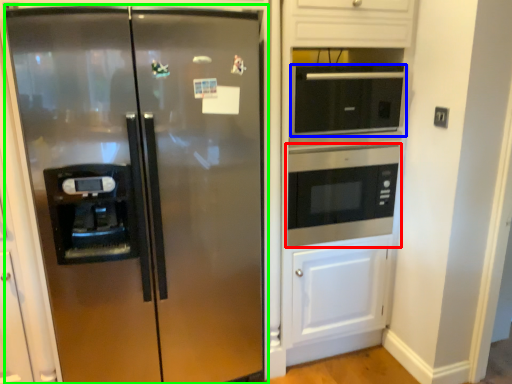
Question: Which object is positioned closest to microwave oven (highlighted by a red box)? Select from microwave oven (highlighted by a blue box) and refrigerator (highlighted by a green box).

Choices:
 (A) microwave oven
 (B) refrigerator

Answer: (A)